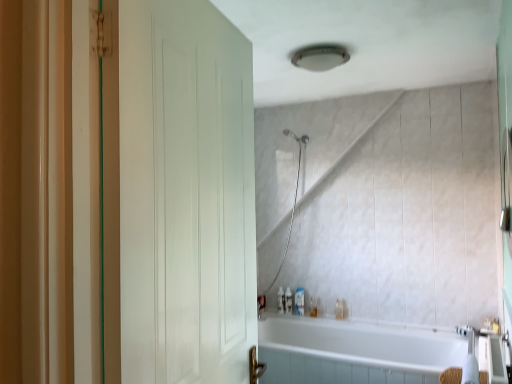
Question: Considering the positions of translucent plastic bottle at lower center, placed as the first toiletry when sorted from left to right, and white matte door at left in the image, is translucent plastic bottle at lower center, placed as the first toiletry when sorted from left to right, wider or thinner than white matte door at left?

Choices:
 (A) thin
 (B) wide

Answer: (A)

Question: In terms of height, does translucent plastic bottle at lower center, placed as the 6th toiletry when sorted from right to left, look taller or shorter compared to white matte door at left?

Choices:
 (A) tall
 (B) short

Answer: (B)

Question: Which is nearer to the translucent plastic soap dispenser at lower center, which ranks as the third toiletry in right-to-left order?

Choices:
 (A) white matte door at left
 (B) translucent plastic soap dispenser at lower center, placed as the fifth toiletry when sorted from right to left
 (C) white glossy faucet at lower right
 (D) translucent plastic bottle at lower center, positioned as the sixth toiletry in left-to-right order
 (E) translucent plastic soap dispenser at lower center, arranged as the 3th toiletry when viewed from the left

Answer: (E)

Question: Estimate the real-world distances between objects in this image. Which object is farther from the white glossy faucet at lower right?

Choices:
 (A) translucent plastic bottle at lower center, placed as the first toiletry when sorted from left to right
 (B) translucent plastic soap dispenser at lower center, placed as the fifth toiletry when sorted from right to left
 (C) white glossy bathtub at lower center
 (D) translucent plastic soap at lower center, positioned as the fifth toiletry in left-to-right order
 (E) translucent plastic soap dispenser at lower center, which is the fourth toiletry in left-to-right order

Answer: (A)